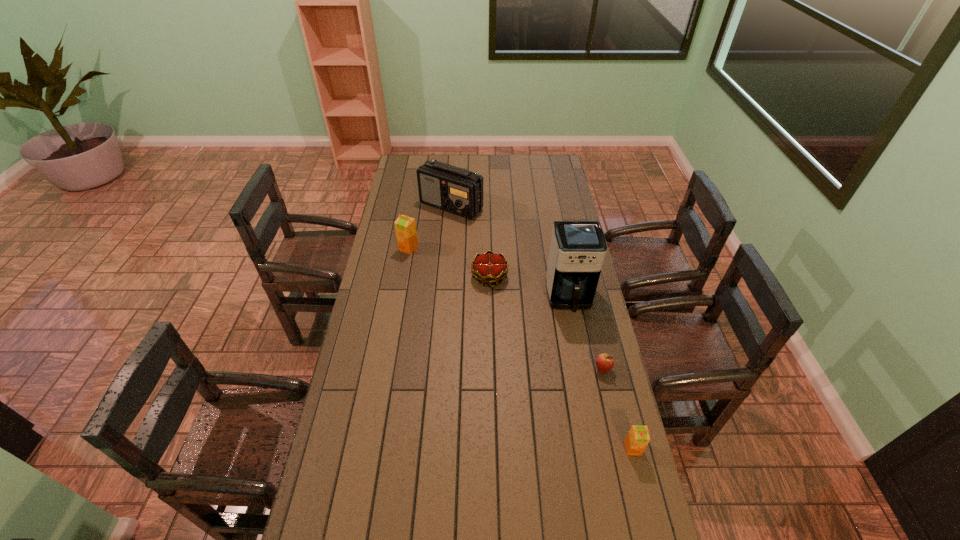
Where is `vacant space that satisfies the following two spatial constraints: 1. on the front panel of the nearer orange juice; 2. on the left side of the coffee maker`? This screenshot has width=960, height=540. vacant space that satisfies the following two spatial constraints: 1. on the front panel of the nearer orange juice; 2. on the left side of the coffee maker is located at coordinates tap(598, 448).

The height and width of the screenshot is (540, 960). I want to click on vacant area in the image that satisfies the following two spatial constraints: 1. on the front panel of the crown; 2. on the right side of the radio receiver, so click(x=445, y=276).